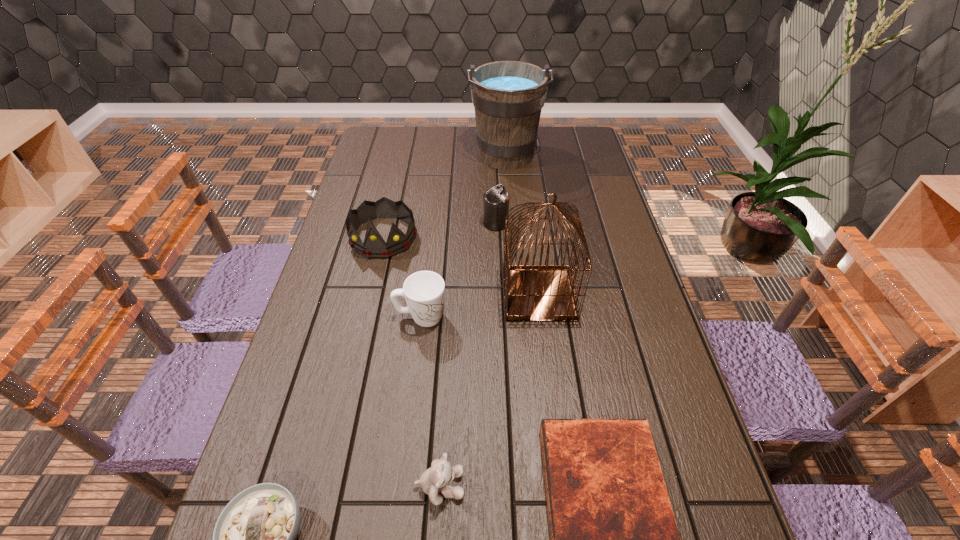
Identify which object is located as the fifth nearest to the seventh tallest object. Please provide its 2D coordinates. Your answer should be formatted as a tuple, i.e. [(x, y)], where the tuple contains the x and y coordinates of a point satisfying the conditions above.

[(374, 246)]